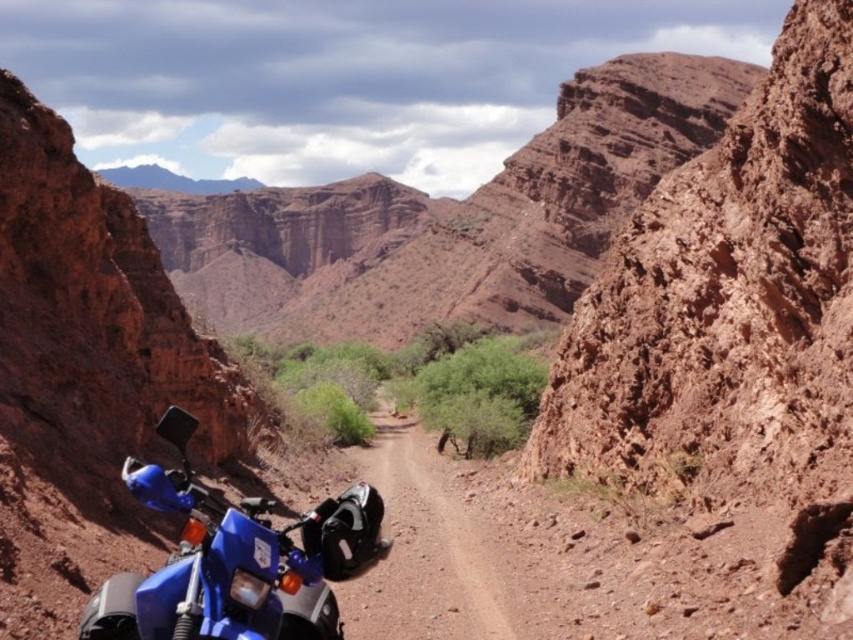
Question: Based on their relative distances, which object is farther from the blue matte motorcycle at lower left?

Choices:
 (A) dirt/granular mountain path at center
 (B) rustic rock formation at center

Answer: (B)

Question: Which point appears closest to the camera in this image?

Choices:
 (A) (378, 509)
 (B) (350, 321)
 (C) (364, 598)

Answer: (A)

Question: In this image, where is blue matte motorcycle at lower left located relative to dirt/granular mountain path at center?

Choices:
 (A) above
 (B) below

Answer: (A)

Question: Where is blue matte motorcycle at lower left located in relation to dirt/granular mountain path at center in the image?

Choices:
 (A) below
 (B) above

Answer: (B)

Question: Which point appears closest to the camera in this image?

Choices:
 (A) (322, 545)
 (B) (384, 432)

Answer: (A)

Question: From the image, what is the correct spatial relationship of blue matte motorcycle at lower left in relation to dirt/granular mountain path at center?

Choices:
 (A) left
 (B) right

Answer: (A)